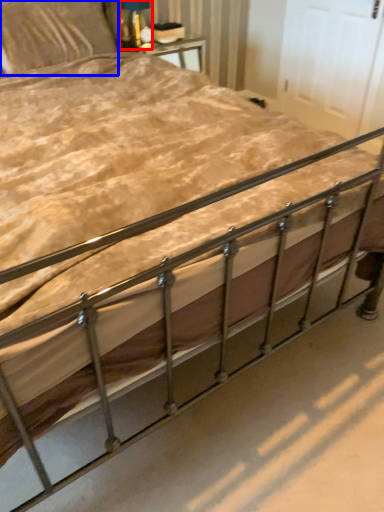
Question: Which of the following is the farthest to the observer, table lamp (highlighted by a red box) or pillow (highlighted by a blue box)?

Choices:
 (A) table lamp
 (B) pillow

Answer: (A)